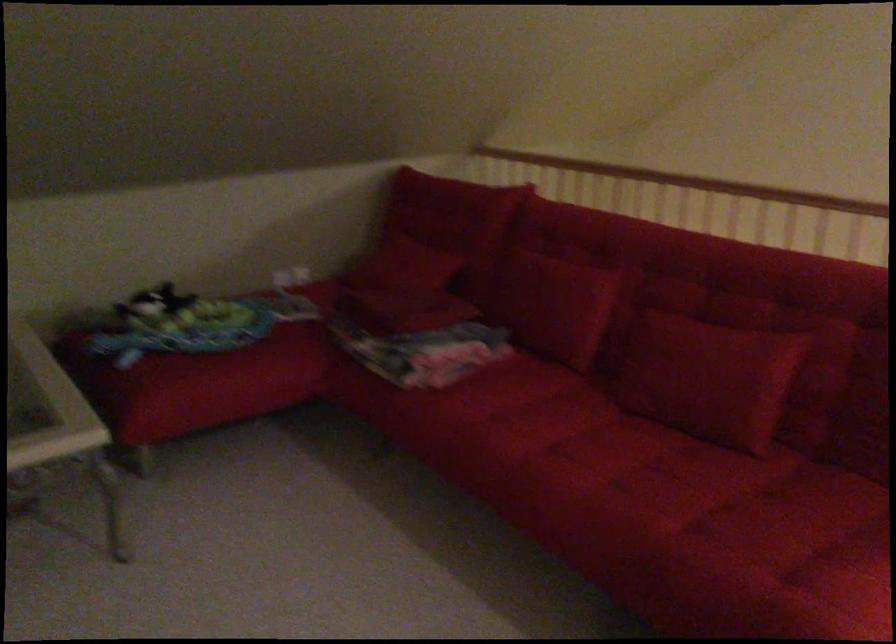
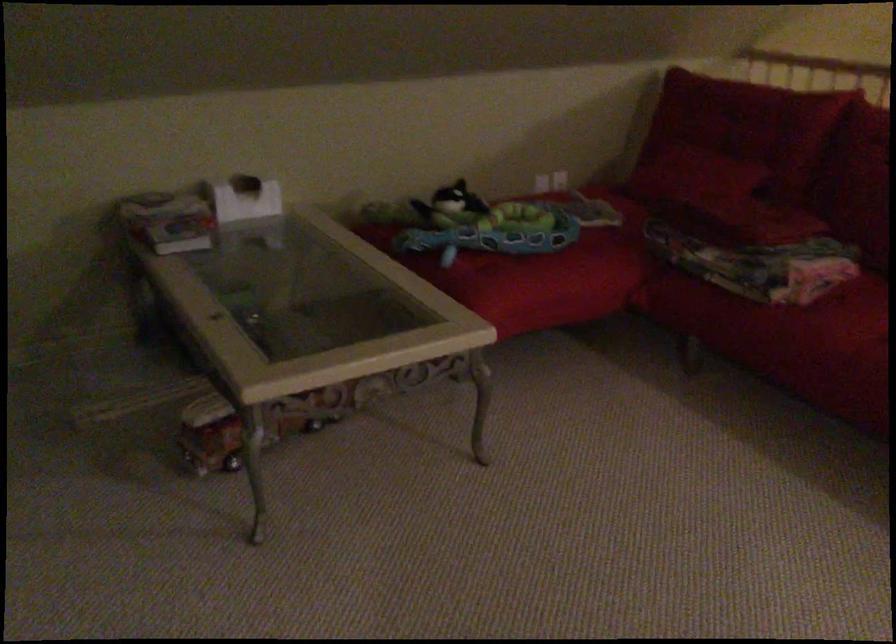
Locate, in the second image, the point that corresponds to point 407,312 in the first image.

(761, 220)